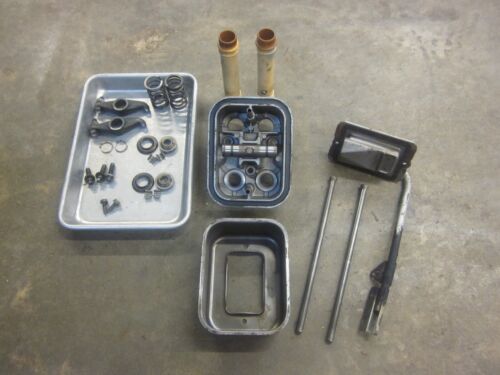
Where is `cover of electrical box`? cover of electrical box is located at coordinates (234, 159).